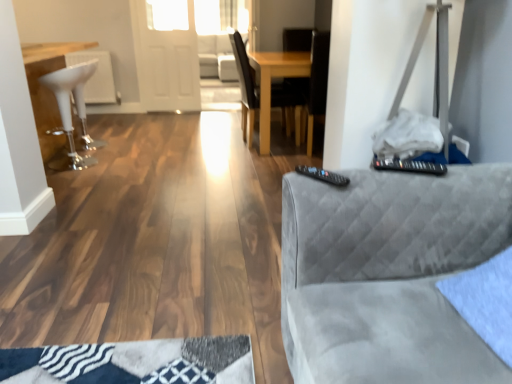
Question: In the image, is transparent glass door at upper center positioned in front of or behind white glossy bar stool at left?

Choices:
 (A) front
 (B) behind

Answer: (B)

Question: Looking at their shapes, would you say transparent glass door at upper center is wider or thinner than white glossy bar stool at left?

Choices:
 (A) wide
 (B) thin

Answer: (B)

Question: Based on their relative distances, which object is nearer to the black plastic remote at right?

Choices:
 (A) black plastic remote at upper right
 (B) wooden chair at center
 (C) transparent glass door at upper center
 (D) white fabric couch at center
 (E) suede gray couch at right

Answer: (E)

Question: Estimate the real-world distances between objects in this image. Which object is closer to the black plastic remote at upper right?

Choices:
 (A) white glossy bar stool at left
 (B) black plastic remote at right
 (C) wooden chair at center
 (D) suede gray couch at right
 (E) transparent glass door at upper center

Answer: (B)